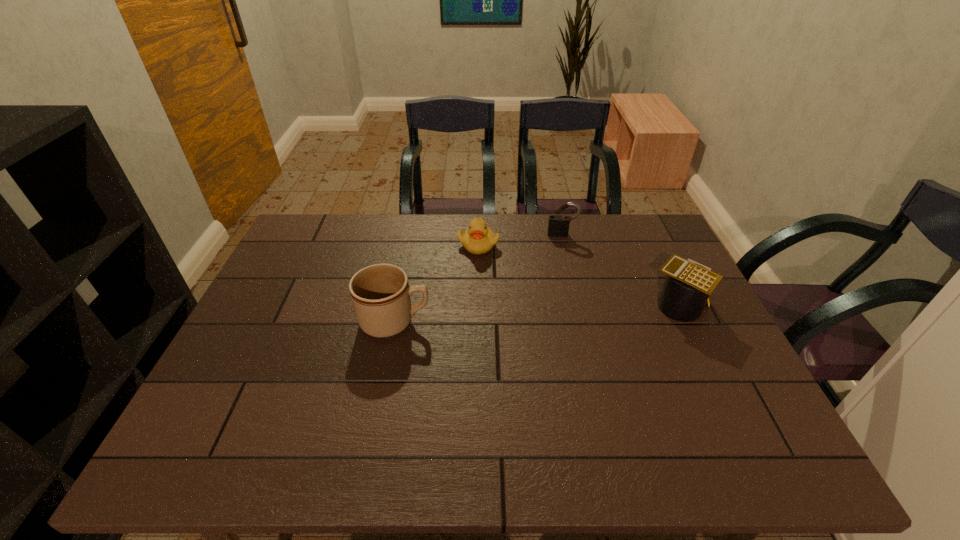
You are a GUI agent. You are given a task and a screenshot of the screen. Output one action in this format:
    pyautogui.click(x=<x>, y=<y>)
    Task: Click on the free point between the mug and the calculator
    The image size is (960, 540).
    Given the screenshot: What is the action you would take?
    pyautogui.click(x=537, y=313)

The height and width of the screenshot is (540, 960). What are the coordinates of `vacant area that lies between the third object from left to right and the calculator` in the screenshot? It's located at (620, 270).

Where is `object that is the second closest to the padlock`? object that is the second closest to the padlock is located at coordinates (687, 287).

Select which object is the closest to the shortest object. Please provide its 2D coordinates. Your answer should be formatted as a tuple, i.e. [(x, y)], where the tuple contains the x and y coordinates of a point satisfying the conditions above.

[(558, 226)]